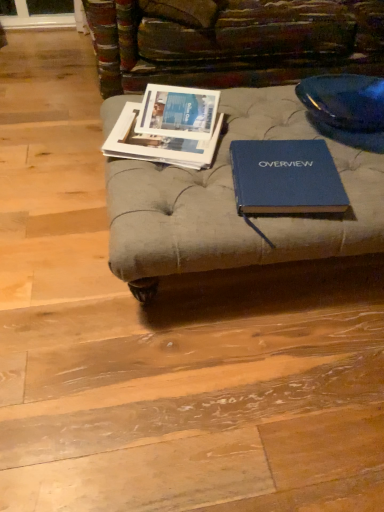
The height and width of the screenshot is (512, 384). In order to click on vacant area on top of matte paper magazines at center left, the 1th book in the left-to-right sequence (from a real-world perspective) in this screenshot , I will do `click(175, 119)`.